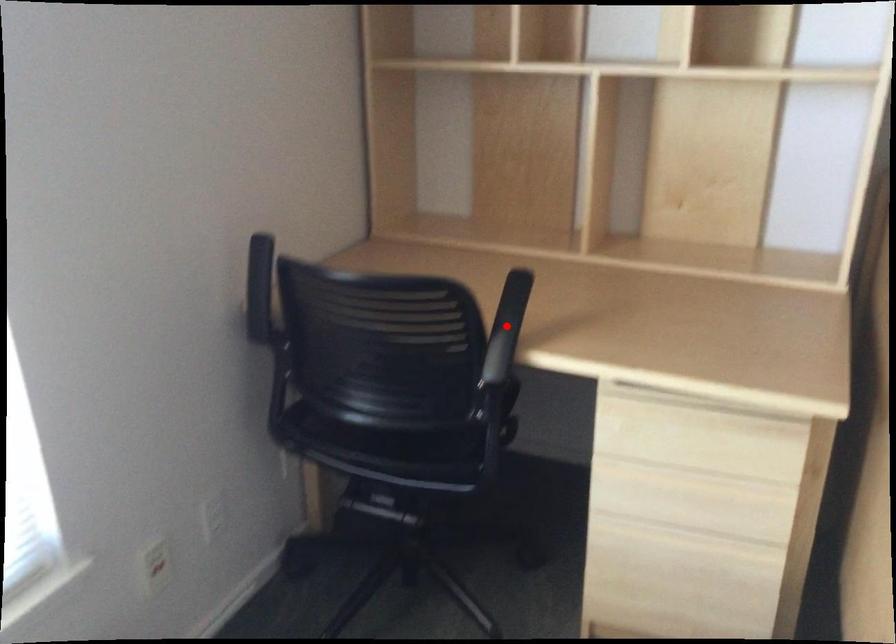
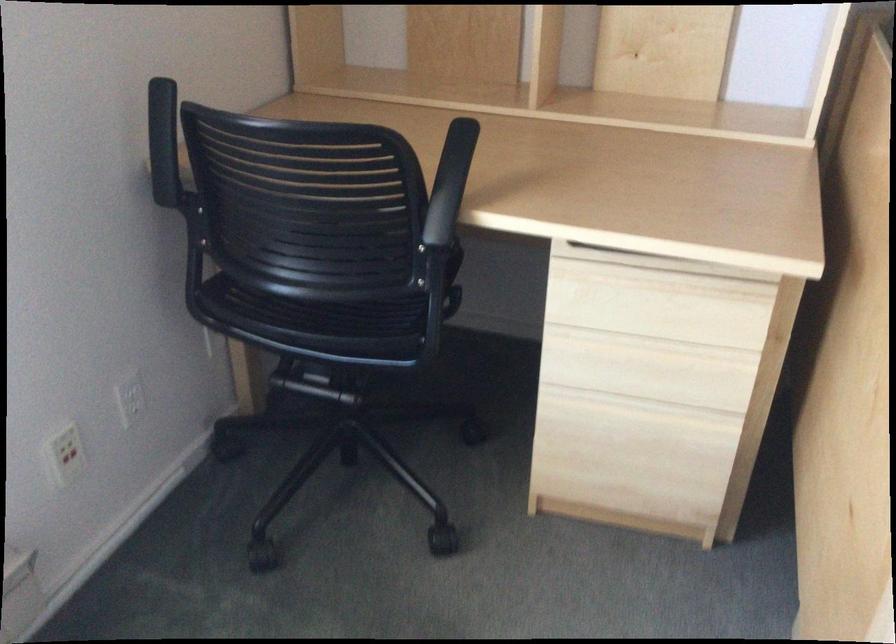
Question: A red point is marked in image1. In image2, is the corresponding 3D point closer to the camera or farther? Reply with the corresponding letter.

Choices:
 (A) The corresponding 3D point is closer.
 (B) The corresponding 3D point is farther.

Answer: (A)